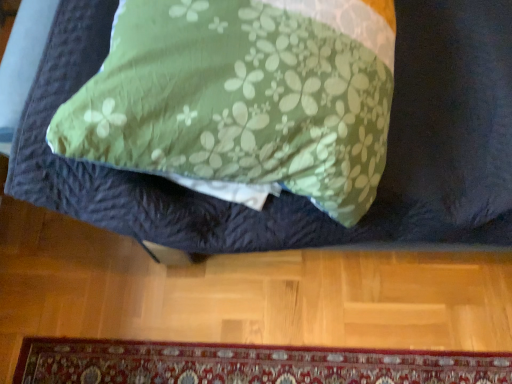
What are the coordinates of `free point below carpeted mat at lower center (from a real-world perspective)` in the screenshot? It's located at (256, 364).